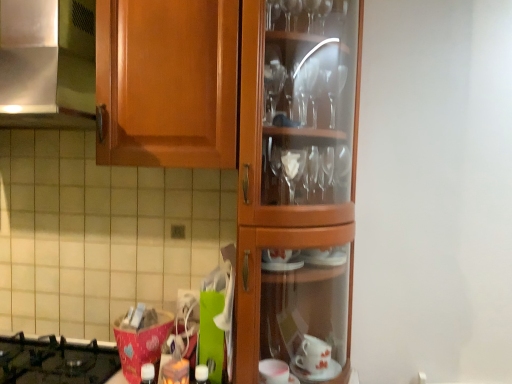
Where is `black glass gas stove at lower left`? black glass gas stove at lower left is located at coordinates (55, 361).

The width and height of the screenshot is (512, 384). What do you see at coordinates (202, 374) in the screenshot? I see `white matte bottle at center` at bounding box center [202, 374].

At what (x,y) coordinates should I click in order to perform the action: click on black glass gas stove at lower left. Please return your answer as a coordinate pair (x, y). This screenshot has width=512, height=384. Looking at the image, I should click on (55, 361).

Is black glass gas stove at lower left facing towards satin silver metal at upper left?

No, black glass gas stove at lower left is not oriented towards satin silver metal at upper left.

This screenshot has width=512, height=384. Identify the location of gas stove below the satin silver metal at upper left (from a real-world perspective). (55, 361).

From the image's perspective, is black glass gas stove at lower left on satin silver metal at upper left?

Incorrect, from the image's perspective, black glass gas stove at lower left is lower than satin silver metal at upper left.

From the image's perspective, is white matte bottle at center located beneath satin silver metal at upper left?

Yes, from the image's perspective, white matte bottle at center is beneath satin silver metal at upper left.

Is white matte bottle at center taller or shorter than satin silver metal at upper left?

Clearly, white matte bottle at center is shorter compared to satin silver metal at upper left.

Does white matte bottle at center contain satin silver metal at upper left?

No, satin silver metal at upper left is not surrounded by white matte bottle at center.

Where is `bottle below the satin silver metal at upper left (from the image's perspective)`? Image resolution: width=512 pixels, height=384 pixels. bottle below the satin silver metal at upper left (from the image's perspective) is located at coordinates (202, 374).

Choose the correct answer: Is satin silver metal at upper left inside white matte bottle at center or outside it?

The correct answer is: outside.

From the image's perspective, is satin silver metal at upper left above or below white matte bottle at center?

Clearly, from the image's perspective, satin silver metal at upper left is above white matte bottle at center.

Which is farther, (28,360) or (197,370)?

The point (28,360) is behind.

In the scene shown: How far apart are black glass gas stove at lower left and white matte bottle at center?

A: black glass gas stove at lower left is 50.71 centimeters away from white matte bottle at center.

Could you tell me if black glass gas stove at lower left is facing white matte bottle at center?

No.

Where is `gas stove lying on the left of white matte bottle at center`? gas stove lying on the left of white matte bottle at center is located at coordinates (55, 361).

Which object is further away from the camera taking this photo, white matte bottle at center or black glass gas stove at lower left?

black glass gas stove at lower left.

Does white matte bottle at center have a greater width compared to black glass gas stove at lower left?

No.

Would you say white matte bottle at center is outside black glass gas stove at lower left?

Yes, white matte bottle at center is not within black glass gas stove at lower left.

From the image's perspective, does white matte bottle at center appear higher than black glass gas stove at lower left?

Yes, from the image's perspective, white matte bottle at center is over black glass gas stove at lower left.

From the image's perspective, is satin silver metal at upper left under black glass gas stove at lower left?

Actually, satin silver metal at upper left appears above black glass gas stove at lower left in the image.

From the picture: Can you confirm if satin silver metal at upper left is bigger than black glass gas stove at lower left?

Indeed, satin silver metal at upper left has a larger size compared to black glass gas stove at lower left.

Is satin silver metal at upper left completely or partially outside of black glass gas stove at lower left?

Yes, satin silver metal at upper left is located beyond the bounds of black glass gas stove at lower left.

The height and width of the screenshot is (384, 512). Identify the location of gas stove lying on the left of satin silver metal at upper left. (55, 361).

Where is `bottle that is behind the satin silver metal at upper left`? This screenshot has height=384, width=512. bottle that is behind the satin silver metal at upper left is located at coordinates (202, 374).

Based on their spatial positions, is satin silver metal at upper left or white matte bottle at center closer to black glass gas stove at lower left?

Based on the image, white matte bottle at center appears to be nearer to black glass gas stove at lower left.

Looking at the image, which one is located closer to black glass gas stove at lower left, white matte bottle at center or satin silver metal at upper left?

white matte bottle at center.

From the image, which object appears to be farther from white matte bottle at center, satin silver metal at upper left or black glass gas stove at lower left?

The object further to white matte bottle at center is satin silver metal at upper left.

Considering their positions, is black glass gas stove at lower left positioned further to white matte bottle at center than satin silver metal at upper left?

Among the two, satin silver metal at upper left is located further to white matte bottle at center.

Considering their positions, is black glass gas stove at lower left positioned closer to satin silver metal at upper left than white matte bottle at center?

black glass gas stove at lower left is positioned closer to the anchor satin silver metal at upper left.

Which object lies nearer to the anchor point satin silver metal at upper left, white matte bottle at center or black glass gas stove at lower left?

Based on the image, black glass gas stove at lower left appears to be nearer to satin silver metal at upper left.

You are a GUI agent. You are given a task and a screenshot of the screen. Output one action in this format:
    pyautogui.click(x=<x>, y=<y>)
    Task: Click on the bottle between satin silver metal at upper left and black glass gas stove at lower left from top to bottom
    The image size is (512, 384).
    Given the screenshot: What is the action you would take?
    pyautogui.click(x=202, y=374)